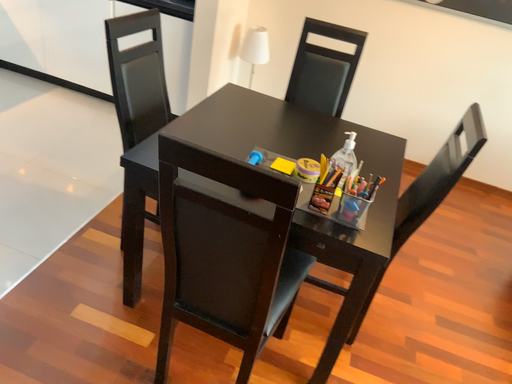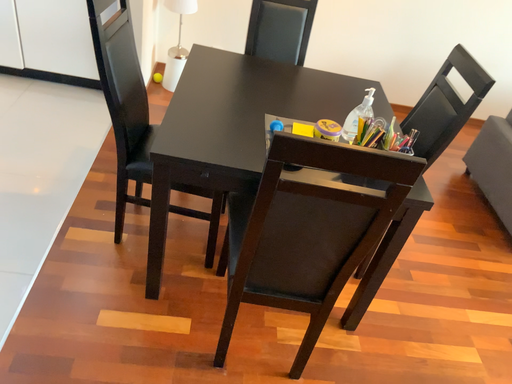
Question: Which way did the camera rotate in the video?

Choices:
 (A) rotated upward
 (B) rotated downward

Answer: (B)